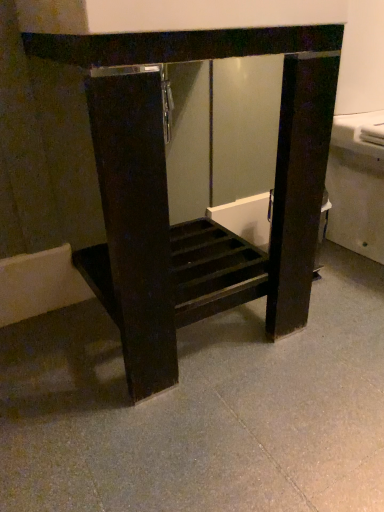
Question: Is matte black cabinet at center spatially inside gray polished concrete at center, or outside of it?

Choices:
 (A) inside
 (B) outside

Answer: (B)

Question: Based on their sizes in the image, would you say matte black cabinet at center is bigger or smaller than gray polished concrete at center?

Choices:
 (A) small
 (B) big

Answer: (B)

Question: Relative to gray polished concrete at center, is matte black cabinet at center in front or behind?

Choices:
 (A) behind
 (B) front

Answer: (A)

Question: Considering the positions of point (216, 480) and point (114, 47), is point (216, 480) closer or farther from the camera than point (114, 47)?

Choices:
 (A) closer
 (B) farther

Answer: (B)

Question: Is gray polished concrete at center wider or thinner than matte black cabinet at center?

Choices:
 (A) wide
 (B) thin

Answer: (A)

Question: From the image's perspective, is gray polished concrete at center positioned above or below matte black cabinet at center?

Choices:
 (A) above
 (B) below

Answer: (B)

Question: Considering their positions, is gray polished concrete at center located in front of or behind matte black cabinet at center?

Choices:
 (A) front
 (B) behind

Answer: (A)